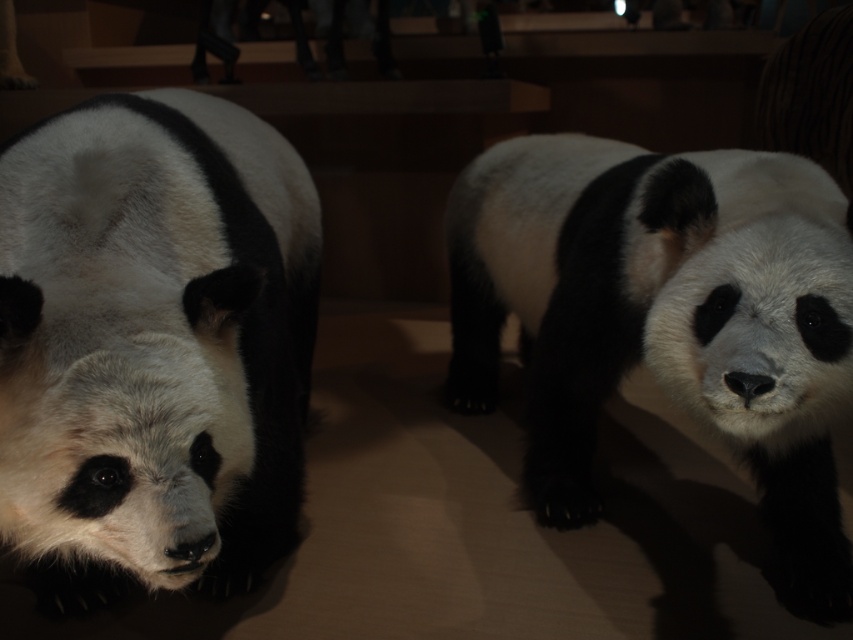
Can you confirm if black and white fur panda at left is taller than black and white fur panda at center?

No.

Does black and white fur panda at left have a greater width compared to black and white fur panda at center?

Incorrect, black and white fur panda at left's width does not surpass black and white fur panda at center's.

Does point (78, 454) come behind point (695, 228)?

No, (78, 454) is closer to viewer.

Where is `black and white fur panda at left`? Image resolution: width=853 pixels, height=640 pixels. black and white fur panda at left is located at coordinates (154, 342).